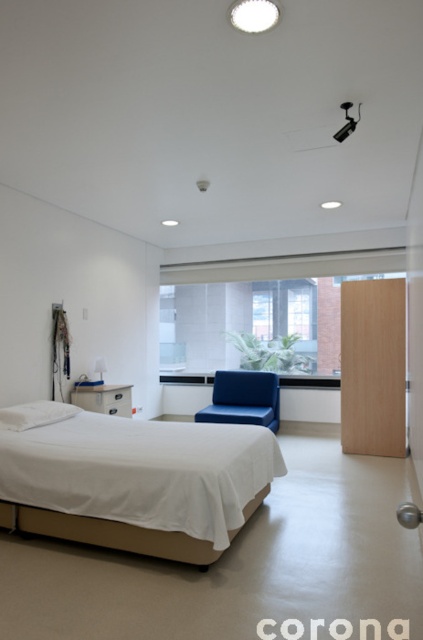
Question: Which of the following is the closest to the observer?

Choices:
 (A) (249, 420)
 (B) (32, 404)
 (C) (271, 324)

Answer: (B)

Question: From the image, what is the correct spatial relationship of white fabric bed at lower left in relation to matte blue armchair at center?

Choices:
 (A) above
 (B) below

Answer: (B)

Question: Is clear glass window at center smaller than matte blue armchair at center?

Choices:
 (A) yes
 (B) no

Answer: (B)

Question: Among these points, which one is nearest to the camera?

Choices:
 (A) (194, 374)
 (B) (252, 420)
 (C) (173, 516)

Answer: (C)

Question: Does matte blue armchair at center appear on the left side of white fluffy pillow at center?

Choices:
 (A) no
 (B) yes

Answer: (A)

Question: Which point is closer to the camera?

Choices:
 (A) (69, 515)
 (B) (235, 392)
 (C) (63, 404)
 (D) (230, 337)

Answer: (A)